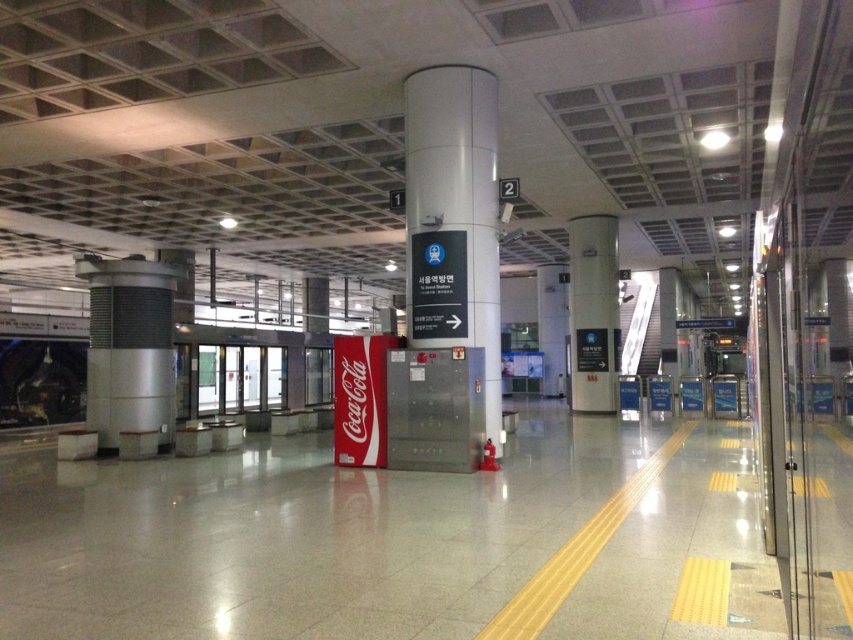
You are a traveler at the subway station and need to reach the Seoul Express Station. You see the silver metallic pillar at left and the white glossy pillar at center. Which pillar is closer to you?

The silver metallic pillar at left is closer to you because it is in front of the white glossy pillar at center.